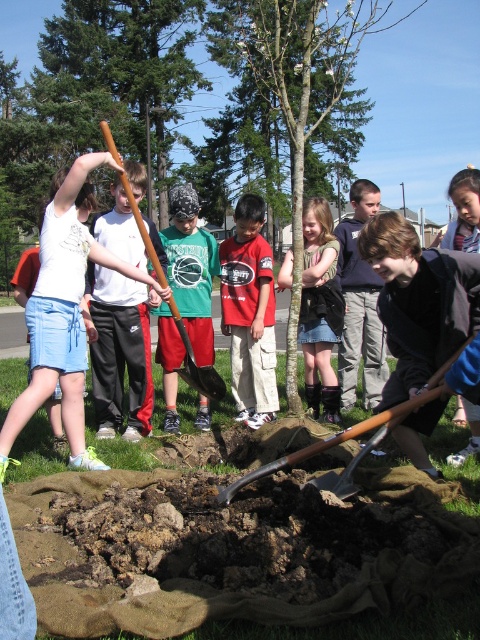
Looking at this image, you are a photographer trying to capture a clear photo of the red cotton shirt at center and the matte black shirt at center. Which one is closer to the camera?

The red cotton shirt at center is in front of the matte black shirt at center, so it is closer to the camera.

You are a photographer at the tree planting event. You want to capture a photo that includes both the red cotton shirt at center and the denim skirt at center. Which clothing item should you focus on first if you want to ensure both are in frame without zooming in?

The red cotton shirt at center has a smaller size compared to denim skirt at center. Therefore, focusing on the red cotton shirt at center first will help ensure both are in frame without needing to zoom in, as it is smaller and might require more precise framing to include both.